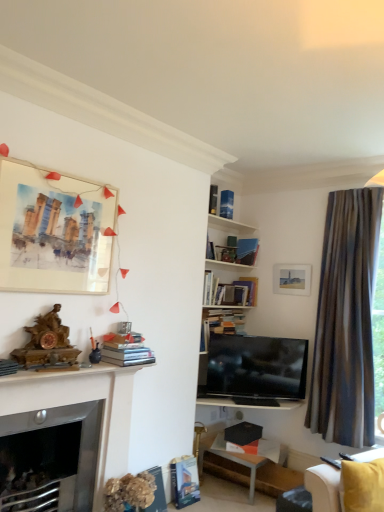
You are a GUI agent. You are given a task and a screenshot of the screen. Output one action in this format:
    pyautogui.click(x=<x>, y=<y>)
    Task: Click on the watercolor paper painting at upper left, which is the second picture frame from back to front
    The image size is (384, 512).
    Given the screenshot: What is the action you would take?
    pyautogui.click(x=53, y=232)

What are the coordinates of `hardcover book at lower center, the second book from the bottom` in the screenshot? It's located at (184, 481).

This screenshot has height=512, width=384. What do you see at coordinates (248, 470) in the screenshot? I see `white glossy side table at lower center` at bounding box center [248, 470].

Locate an element on the screen. This screenshot has height=512, width=384. hardcover book at upper center, the second book from the top is located at coordinates (226, 204).

Measure the distance between point (164, 510) and camera.

Point (164, 510) is 3.41 meters away from camera.

Where is `watercolor paper painting at upper left, the second picture frame in the right-to-left sequence`? This screenshot has width=384, height=512. watercolor paper painting at upper left, the second picture frame in the right-to-left sequence is located at coordinates (53, 232).

Starting from the brown striped curtain at right, which book is the 2nd one to the left? Please provide its 2D coordinates.

[(226, 204)]

Considering the positions of objects hardcover book at upper center, which is the seventh book from bottom to top, and brown striped curtain at right in the image provided, who is more to the left, hardcover book at upper center, which is the seventh book from bottom to top, or brown striped curtain at right?

hardcover book at upper center, which is the seventh book from bottom to top, is more to the left.

From the image's perspective, is hardcover book at upper center, the second book from the top, on top of brown striped curtain at right?

Correct, hardcover book at upper center, the second book from the top, appears higher than brown striped curtain at right in the image.

Considering the sizes of objects hardcover book at upper center, the second book from the top, and brown striped curtain at right in the image provided, who is wider, hardcover book at upper center, the second book from the top, or brown striped curtain at right?

brown striped curtain at right.

Are brown striped curtain at right and matte white picture frame at upper right, the 1th picture frame positioned from the back, located far from each other?

That's not correct — brown striped curtain at right is a little close to matte white picture frame at upper right, the 1th picture frame positioned from the back.

Considering the relative positions of brown striped curtain at right and matte white picture frame at upper right, the 1th picture frame positioned from the back, in the image provided, is brown striped curtain at right to the left or to the right of matte white picture frame at upper right, the 1th picture frame positioned from the back,?

Clearly, brown striped curtain at right is on the right of matte white picture frame at upper right, the 1th picture frame positioned from the back, in the image.

Considering the sizes of objects brown striped curtain at right and matte white picture frame at upper right, the 1th picture frame positioned from the back, in the image provided, who is thinner, brown striped curtain at right or matte white picture frame at upper right, the 1th picture frame positioned from the back,?

Thinner between the two is matte white picture frame at upper right, the 1th picture frame positioned from the back.

Does brown striped curtain at right turn towards matte white picture frame at upper right, acting as the 1th picture frame starting from the right?

No.

Which book is the 4th one when counting from the right side of the white glossy fireplace at lower left? Please provide its 2D coordinates.

[(184, 481)]

Considering the relative positions of white glossy fireplace at lower left and hardcover book at lower center, the second book from the bottom, in the image provided, is white glossy fireplace at lower left to the left or to the right of hardcover book at lower center, the second book from the bottom,?

From the image, it's evident that white glossy fireplace at lower left is to the left of hardcover book at lower center, the second book from the bottom.

Does white glossy fireplace at lower left have a lesser width compared to hardcover book at lower center, the second book from the bottom?

In fact, white glossy fireplace at lower left might be wider than hardcover book at lower center, the second book from the bottom.

Who is more distant, white glossy fireplace at lower left or hardcover book at lower center, acting as the seventh book starting from the top?

Positioned behind is hardcover book at lower center, acting as the seventh book starting from the top.

Can you see hardcover book at upper center, which is the seventh book from bottom to top, touching hardcover book at upper center, which ranks as the eighth book in bottom-to-top order?

Absolutely, hardcover book at upper center, which is the seventh book from bottom to top, is next to and touching hardcover book at upper center, which ranks as the eighth book in bottom-to-top order.

From a real-world perspective, does hardcover book at upper center, which is the seventh book from bottom to top, stand above hardcover book at upper center, which ranks as the eighth book in bottom-to-top order?

Yes, from a real-world perspective, hardcover book at upper center, which is the seventh book from bottom to top, is above hardcover book at upper center, which ranks as the eighth book in bottom-to-top order.

In terms of size, does hardcover book at upper center, which is the seventh book from bottom to top, appear bigger or smaller than hardcover book at upper center, which ranks as the eighth book in bottom-to-top order?

Clearly, hardcover book at upper center, which is the seventh book from bottom to top, is larger in size than hardcover book at upper center, which ranks as the eighth book in bottom-to-top order.

Which is behind, point (209, 203) or point (258, 475)?

The point (209, 203) is farther.

Is white glossy side table at lower center completely or partially inside hardcover book at upper center, which ranks as the eighth book in bottom-to-top order?

No, hardcover book at upper center, which ranks as the eighth book in bottom-to-top order, does not contain white glossy side table at lower center.

Does hardcover book at upper center, placed as the 1th book when sorted from top to bottom, have a greater width compared to white glossy side table at lower center?

In fact, hardcover book at upper center, placed as the 1th book when sorted from top to bottom, might be narrower than white glossy side table at lower center.

Who is bigger, hardcover book at upper center, placed as the 1th book when sorted from top to bottom, or white glossy side table at lower center?

white glossy side table at lower center.

In the scene shown: Can you confirm if white glossy fireplace at lower left is taller than hardcover book at lower center, which is counted as the sixth book, starting from the top?

Yes, white glossy fireplace at lower left is taller than hardcover book at lower center, which is counted as the sixth book, starting from the top.

Is white glossy fireplace at lower left aimed at hardcover book at lower center, which is the third book in bottom-to-top order?

No, white glossy fireplace at lower left is not aimed at hardcover book at lower center, which is the third book in bottom-to-top order.

Can you confirm if white glossy fireplace at lower left is positioned to the right of hardcover book at lower center, which is counted as the sixth book, starting from the top?

In fact, white glossy fireplace at lower left is to the left of hardcover book at lower center, which is counted as the sixth book, starting from the top.

Is white glossy fireplace at lower left wider or thinner than hardcover book at lower center, which is counted as the sixth book, starting from the top?

white glossy fireplace at lower left is wider than hardcover book at lower center, which is counted as the sixth book, starting from the top.

Choose the correct answer: Is white glossy side table at lower center inside brown striped curtain at right or outside it?

white glossy side table at lower center lies outside brown striped curtain at right.

Is white glossy side table at lower center at the right side of brown striped curtain at right?

In fact, white glossy side table at lower center is to the left of brown striped curtain at right.

Is white glossy side table at lower center oriented away from brown striped curtain at right?

That's not correct — white glossy side table at lower center is not looking away from brown striped curtain at right.

I want to click on curtain located in front of the white glossy side table at lower center, so click(346, 320).

From a real-world perspective, count 3rd books upward from the brown striped curtain at right and point to it. Please provide its 2D coordinates.

[(226, 204)]

At what (x,y) coordinates should I click in order to perform the action: click on picture frame behind the brown striped curtain at right. Please return your answer as a coordinate pair (x, y). Image resolution: width=384 pixels, height=512 pixels. Looking at the image, I should click on (291, 279).

Looking at this image, from the image, which object appears to be farther from brown striped curtain at right, hardcover book at upper center, which ranks as the third book in top-to-bottom order, or hardcover book at lower center, placed as the first book when sorted from bottom to top?

hardcover book at lower center, placed as the first book when sorted from bottom to top.

Looking at this image, which object lies further to the anchor point white glossy fireplace at lower left, hardcover book at lower center, acting as the eighth book starting from the top, or hardcover book at lower center, which is counted as the sixth book, starting from the top?

Based on the image, hardcover book at lower center, which is counted as the sixth book, starting from the top, appears to be further to white glossy fireplace at lower left.

Based on the photo, considering their positions, is white glossy fireplace at lower left positioned further to yellow fabric couch at lower right than hardcover book at upper center, the second book from the top?

hardcover book at upper center, the second book from the top, is further to yellow fabric couch at lower right.

Considering their positions, is watercolor paper painting at upper left, which is the second picture frame from back to front, positioned closer to matte white picture frame at upper right, the 1th picture frame positioned from the back, than hardcover book at lower center, the second book from the bottom?

hardcover book at lower center, the second book from the bottom.

Looking at this image, considering their positions, is watercolor paper painting at upper left, marked as the 1th picture frame in a left-to-right arrangement, positioned closer to hardcover book at lower center, which is counted as the sixth book, starting from the top, than hardcover books at center, the 5th book positioned from the bottom?

hardcover books at center, the 5th book positioned from the bottom.

Considering their positions, is hardcover book at lower center, acting as the eighth book starting from the top, positioned further to hardcover books at center, the 5th book viewed from the top, than hardcover book at upper center, the sixth book ordered from the bottom?

hardcover book at upper center, the sixth book ordered from the bottom, is positioned further to the anchor hardcover books at center, the 5th book viewed from the top.

Looking at the image, which one is located closer to hardcover book at lower center, which is counted as the sixth book, starting from the top, watercolor paper painting at upper left, marked as the 1th picture frame in a left-to-right arrangement, or hardcover book at lower center, acting as the seventh book starting from the top?

The object closer to hardcover book at lower center, which is counted as the sixth book, starting from the top, is hardcover book at lower center, acting as the seventh book starting from the top.

Which object lies nearer to the anchor point matte white picture frame at upper right, marked as the second picture frame in a left-to-right arrangement, white glossy fireplace at lower left or yellow fabric couch at lower right?

Among the two, yellow fabric couch at lower right is located nearer to matte white picture frame at upper right, marked as the second picture frame in a left-to-right arrangement.

This screenshot has width=384, height=512. Identify the location of picture frame between watercolor paper painting at upper left, which is the second picture frame from back to front, and brown striped curtain at right. (291, 279).

The height and width of the screenshot is (512, 384). What are the coordinates of `side table located between white glossy fireplace at lower left and matte white picture frame at upper right, the 1th picture frame positioned from the back, in the depth direction` in the screenshot? It's located at (248, 470).

The width and height of the screenshot is (384, 512). In order to click on book between hardcover book at upper center, which is the seventh book from bottom to top, and matte white picture frame at upper right, marked as the second picture frame in a left-to-right arrangement, vertically in this screenshot , I will do `click(247, 251)`.

Locate an element on the screen. The width and height of the screenshot is (384, 512). book between black glossy tv at center and hardcover book at lower center, acting as the seventh book starting from the top, from top to bottom is located at coordinates (157, 492).